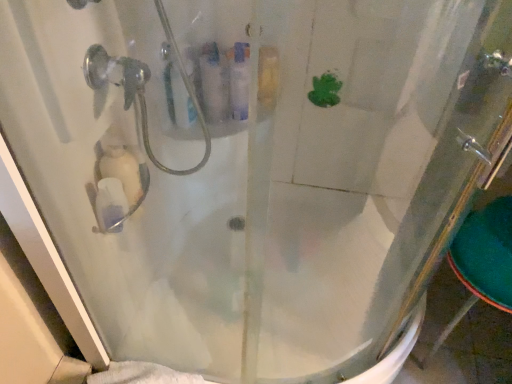
Identify the location of free point below green fabric chair at lower right (from a real-world perspective). The width and height of the screenshot is (512, 384). (462, 342).